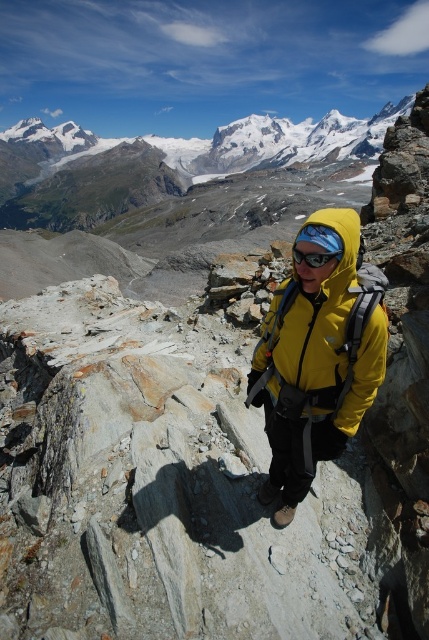
Question: Which of the following is the closest to the observer?

Choices:
 (A) (322, 257)
 (B) (325, 362)

Answer: (A)

Question: Is yellow matte jacket at center wider than transparent plastic goggles at center?

Choices:
 (A) no
 (B) yes

Answer: (B)

Question: Does yellow matte jacket at center have a larger size compared to transparent plastic goggles at center?

Choices:
 (A) yes
 (B) no

Answer: (A)

Question: Which point is farther to the camera?

Choices:
 (A) transparent plastic goggles at center
 (B) yellow matte jacket at center

Answer: (A)

Question: Can you confirm if yellow matte jacket at center is positioned to the right of transparent plastic goggles at center?

Choices:
 (A) no
 (B) yes

Answer: (B)